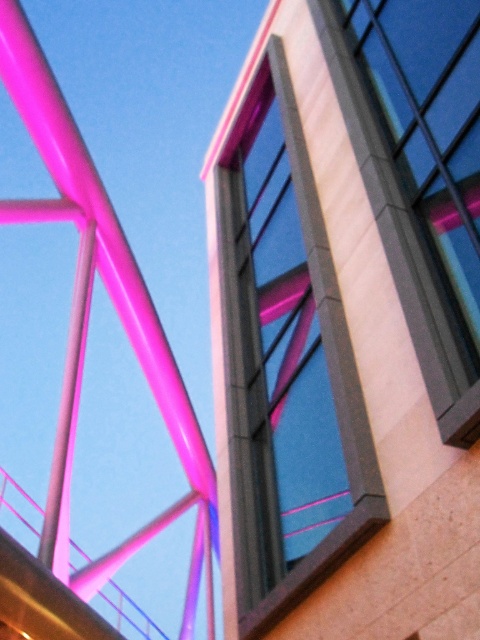
From the picture: You are standing in front of the modern building and want to locate the matte glass window at center. Based on its 2D coordinates, where would you look relative to the center of the image?

The matte glass window at center is located at coordinates approximately 0.577 on the x axis and 0.592 on the y axis, which means it is slightly to the right and above the center point of the image.

Looking up at the modern building from below, you notice two matte glass windows. The first is the matte glass window at center, and the second is the matte glass window at upper right. Which of these two windows is positioned to the left when viewed from your perspective?

The matte glass window at center is positioned to the left of the matte glass window at upper right.

You are standing at the base of the modern building and want to take a photo of the point at coordinates point (x=313, y=192). If your camera has a maximum focus range of 30 feet, will it be able to focus on the point?

The point (x=313, y=192) is 30.56 feet from the camera, which exceeds the maximum focus range of 30 feet. Therefore, the camera will not be able to focus on the point.